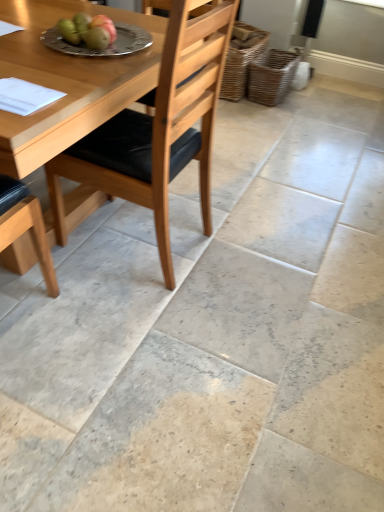
You are a GUI agent. You are given a task and a screenshot of the screen. Output one action in this format:
    pyautogui.click(x=<x>, y=<y>)
    Task: Click on the vacant space in front of woven brown basket at center, the 1th basket viewed from the left
    The width and height of the screenshot is (384, 512).
    Given the screenshot: What is the action you would take?
    pyautogui.click(x=246, y=115)